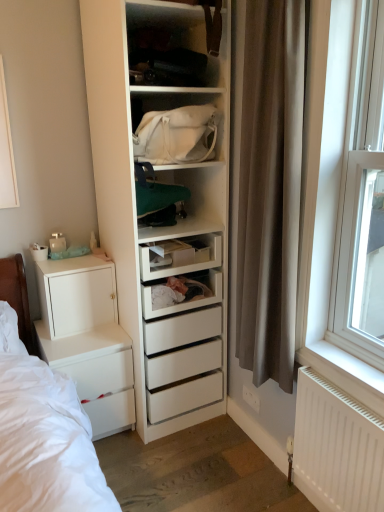
Question: Considering the positions of point (304, 408) and point (220, 2), is point (304, 408) closer or farther from the camera than point (220, 2)?

Choices:
 (A) farther
 (B) closer

Answer: (B)

Question: Based on their positions, is white matte radiator at lower right located to the left or right of matte white shelf at upper center, arranged as the 1th shelf when viewed from the top?

Choices:
 (A) right
 (B) left

Answer: (A)

Question: Estimate the real-world distances between objects in this image. Which object is farther from the white canvas bag at center, marked as the 2th shelf in a top-to-bottom arrangement?

Choices:
 (A) white matte cabinet at lower left
 (B) white matte radiator at lower right
 (C) brown fabric curtain at right
 (D) matte white shelf at upper center, the 2th shelf ordered from the bottom
 (E) white matte chest of drawers at left

Answer: (B)

Question: Estimate the real-world distances between objects in this image. Which object is closer to the brown fabric curtain at right?

Choices:
 (A) matte white shelf at upper center, arranged as the 1th shelf when viewed from the top
 (B) white plastic window at right
 (C) white canvas bag at center, the first shelf in the bottom-to-top sequence
 (D) white matte radiator at lower right
 (E) white matte chest of drawers at left

Answer: (B)